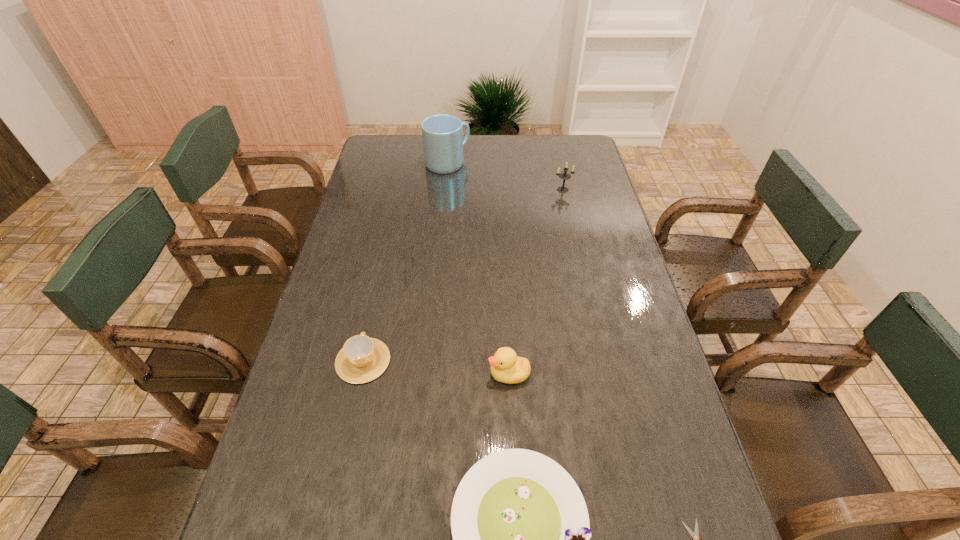
Identify the location of mug. The height and width of the screenshot is (540, 960). (442, 135).

Where is `the tallest object`? the tallest object is located at coordinates (442, 135).

In order to click on the fifth shortest object in this screenshot , I will do click(565, 176).

The height and width of the screenshot is (540, 960). In order to click on candle holder in this screenshot , I will do `click(565, 176)`.

At what (x,y) coordinates should I click in order to perform the action: click on the third tallest object. Please return your answer as a coordinate pair (x, y). Looking at the image, I should click on (506, 367).

Where is `the fourth tallest object`? This screenshot has width=960, height=540. the fourth tallest object is located at coordinates (362, 359).

What are the coordinates of `the leftmost object` in the screenshot? It's located at (362, 359).

Identify the location of free spot located 0.110m on the back of the farthest object. The width and height of the screenshot is (960, 540). (449, 139).

Identify the location of vacant space located on the left of the second tallest object. This screenshot has height=540, width=960. (498, 190).

Locate an element on the screen. Image resolution: width=960 pixels, height=540 pixels. blank space located at the beak of the duck is located at coordinates (x=418, y=374).